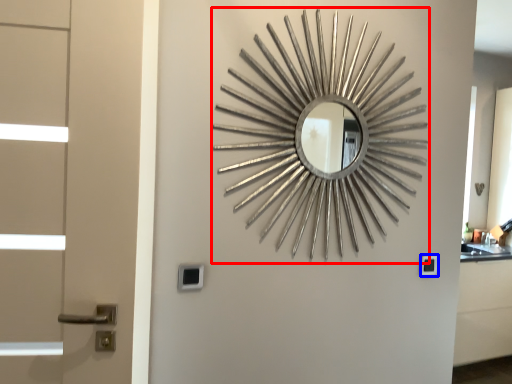
Question: Among these objects, which one is nearest to the camera, design (highlighted by a red box) or lock (highlighted by a blue box)?

Choices:
 (A) design
 (B) lock

Answer: (A)